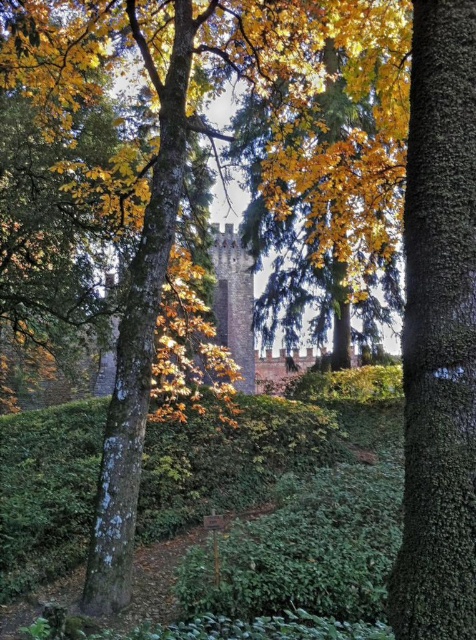
You are a gardener planning to trim both the green leafy hedge at center and the green rough bark tree trunk at center. Based on their sizes, which one would require more time to trim?

The green rough bark tree trunk at center requires more time to trim since it occupies more space than the green leafy hedge at center.

You are standing in the autumnal scene and want to place a small decorative rock between the two points, point [462,400] and point [82,452]. Which point should the rock be closer to if you want it to appear larger in the image?

The rock should be placed closer to point [462,400] because it is closer to the viewer, making objects placed there appear larger in the image.